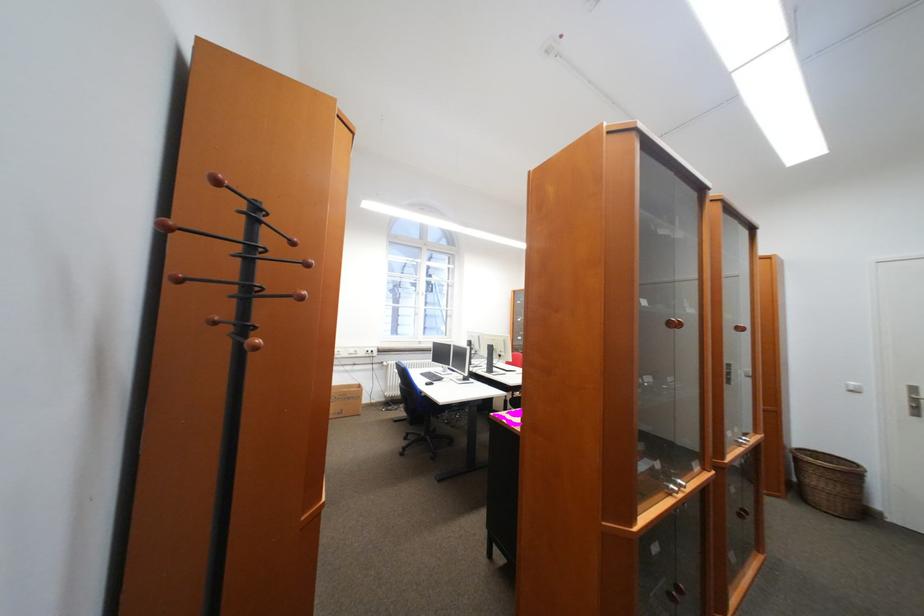
Which object does [345,400] point to?

It refers to a cardboard box.